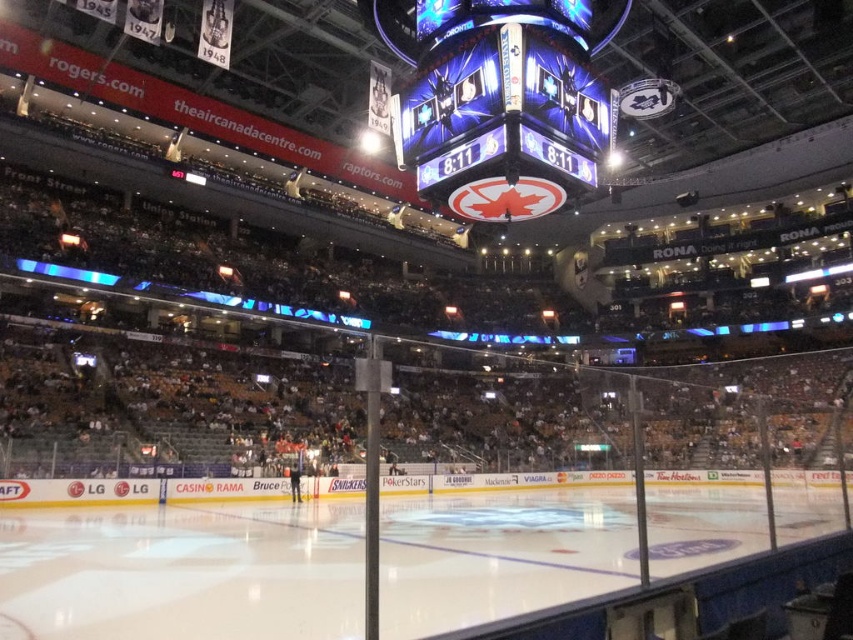
You are a photographer positioned at the center of the arena. You want to take a photo of both point (386, 513) and point (570, 81) in the image. Which point should you focus on first to ensure both are in sharp focus?

You should focus on point (386, 513) first because it is closer to the camera than point (570, 81). By focusing on the closer point, the farther point will also be within the depth of field and in focus.